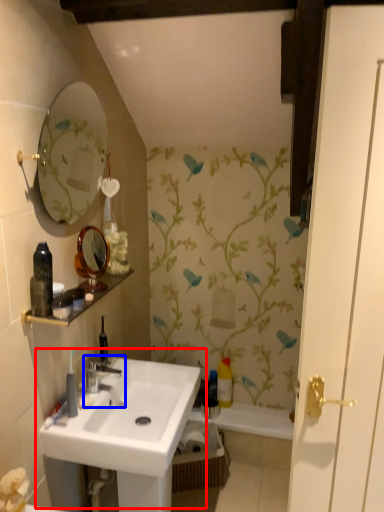
Question: Which point is further to the camera, sink (highlighted by a red box) or tap (highlighted by a blue box)?

Choices:
 (A) sink
 (B) tap

Answer: (B)